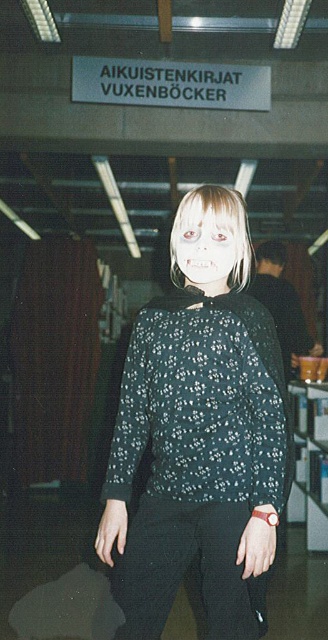
Question: Which object appears farthest from the camera in this image?

Choices:
 (A) white matte face at center
 (B) black floral blouse at center

Answer: (A)

Question: Is the position of black floral blouse at center more distant than that of white matte face at center?

Choices:
 (A) no
 (B) yes

Answer: (A)

Question: Is black floral blouse at center smaller than white matte face at center?

Choices:
 (A) yes
 (B) no

Answer: (B)

Question: Which point is farther from the camera taking this photo?

Choices:
 (A) (211, 355)
 (B) (218, 264)

Answer: (B)

Question: From the image, what is the correct spatial relationship of black floral blouse at center in relation to white matte face at center?

Choices:
 (A) left
 (B) right

Answer: (B)